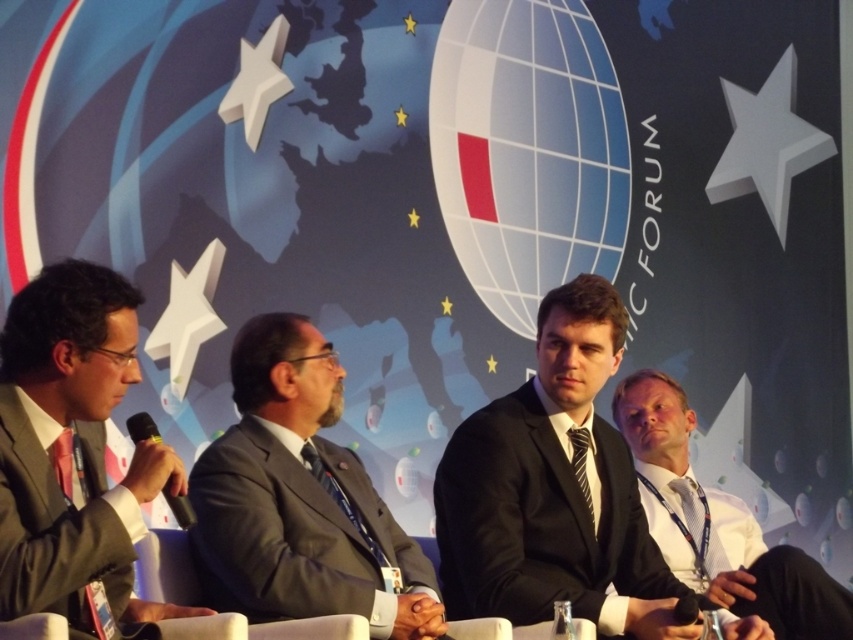
Question: Which object appears closest to the camera in this image?

Choices:
 (A) black suit at center
 (B) black striped tie at center
 (C) white shirt at right

Answer: (A)

Question: Does gray suit at center appear on the left side of white shirt at right?

Choices:
 (A) yes
 (B) no

Answer: (A)

Question: Which point appears farthest from the camera in this image?

Choices:
 (A) (241, 401)
 (B) (469, 490)
 (C) (645, 387)
 (D) (592, 509)

Answer: (C)

Question: From the image, what is the correct spatial relationship of white shirt at right in relation to black plastic microphone at left?

Choices:
 (A) below
 (B) above

Answer: (A)

Question: Which of the following is the closest to the observer?

Choices:
 (A) (822, 577)
 (B) (335, 378)

Answer: (B)

Question: Does black suit at center appear on the right side of matte gray suit at left?

Choices:
 (A) no
 (B) yes

Answer: (B)